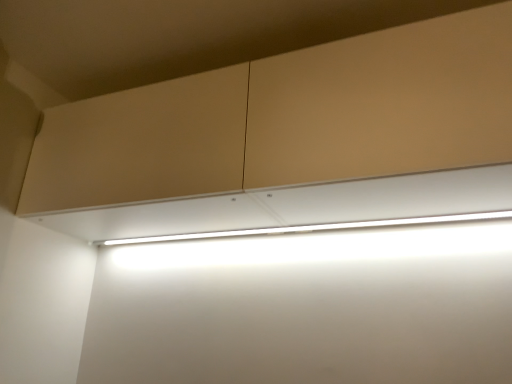
Describe the element at coordinates (289, 119) in the screenshot. The image size is (512, 384). I see `matte beige cabinet at upper center` at that location.

Identify the location of matte beige cabinet at upper center. (289, 119).

At what (x,y) coordinates should I click in order to perform the action: click on matte beige cabinet at upper center. Please return your answer as a coordinate pair (x, y). Image resolution: width=512 pixels, height=384 pixels. Looking at the image, I should click on (289, 119).